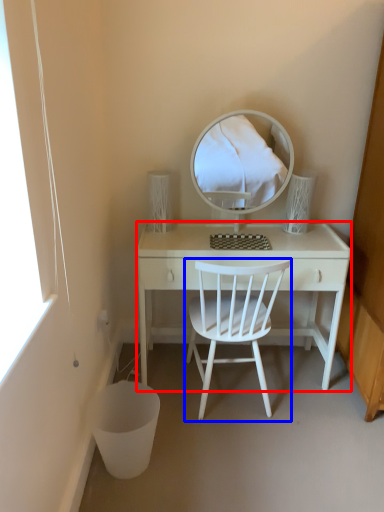
Question: Which point is closer to the camera, desk (highlighted by a red box) or chair (highlighted by a blue box)?

Choices:
 (A) desk
 (B) chair

Answer: (B)